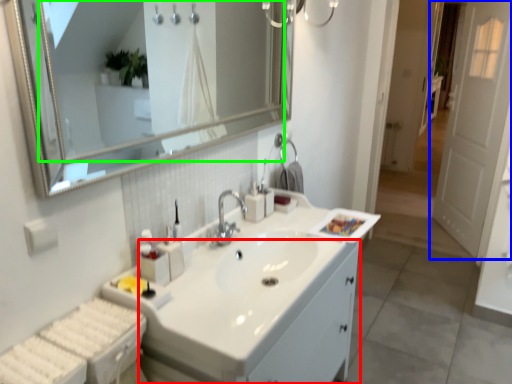
Question: Based on their relative distances, which object is nearer to bathroom cabinet (highlighted by a red box)? Choose from door (highlighted by a blue box) and mirror (highlighted by a green box).

Choices:
 (A) door
 (B) mirror

Answer: (A)